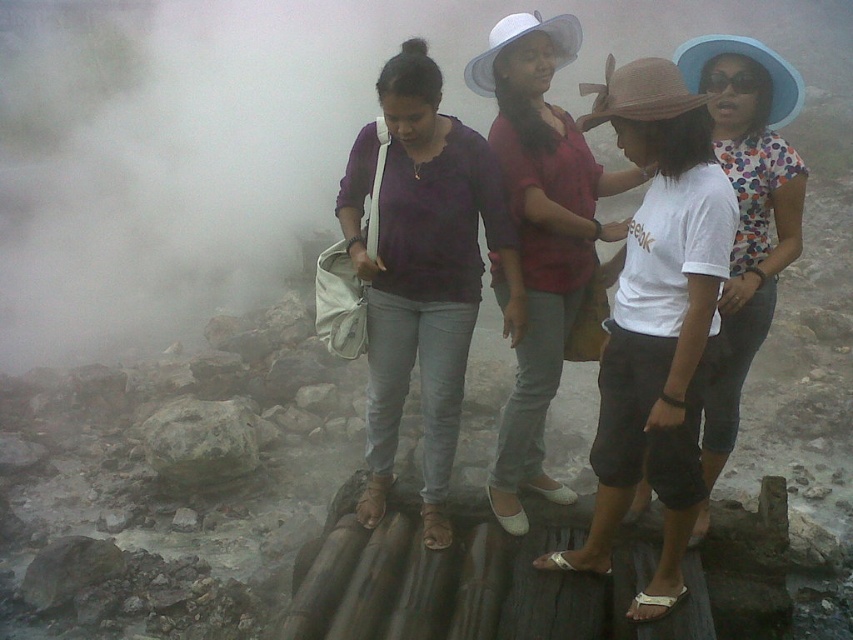
You are standing on the wooden structure with the group and want to take a photo of the white mist at foggy center. Based on its location at point coordinates, where should you aim your camera relative to the group?

The white mist at foggy center is located at point coordinates, so you should aim your camera towards the center area that is foggy to capture it.

Based on the scene description, can you determine if the matte white hat at center is resting on top of the gray rough rock at center?

The matte white hat at center is located above the gray rough rock at center, so it is likely resting on top of it.

You are a photographer trying to capture the group of tourists on the wooden platform. Which object in the scene, the white mist at foggy center or the white cotton shirt at center, would be harder to focus on due to its size?

The white mist at foggy center is larger than the white cotton shirt at center, so it would be harder to focus on due to its size.